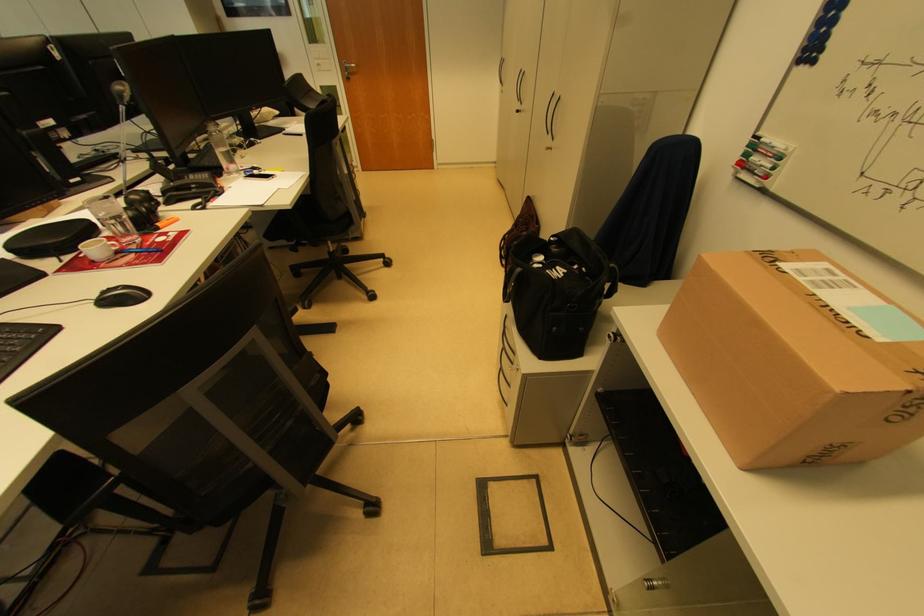
Find the location of a particular element. telephone handset is located at coordinates coord(173,190).